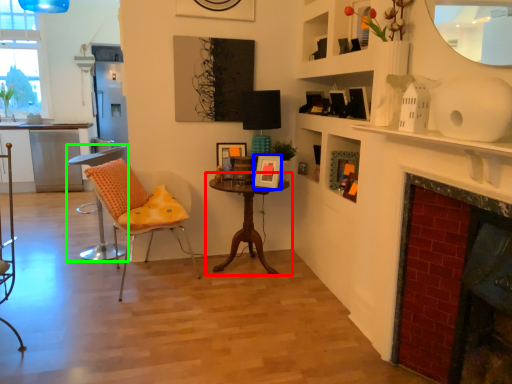
Question: Based on their relative distances, which object is nearer to table (highlighted by a red box)? Choose from picture frame (highlighted by a blue box) and chair (highlighted by a green box).

Choices:
 (A) picture frame
 (B) chair

Answer: (A)